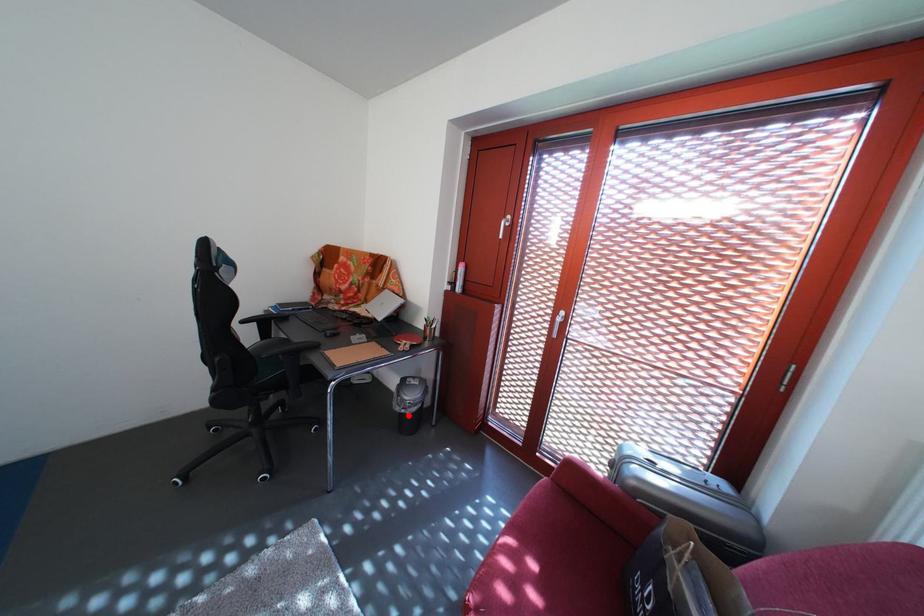
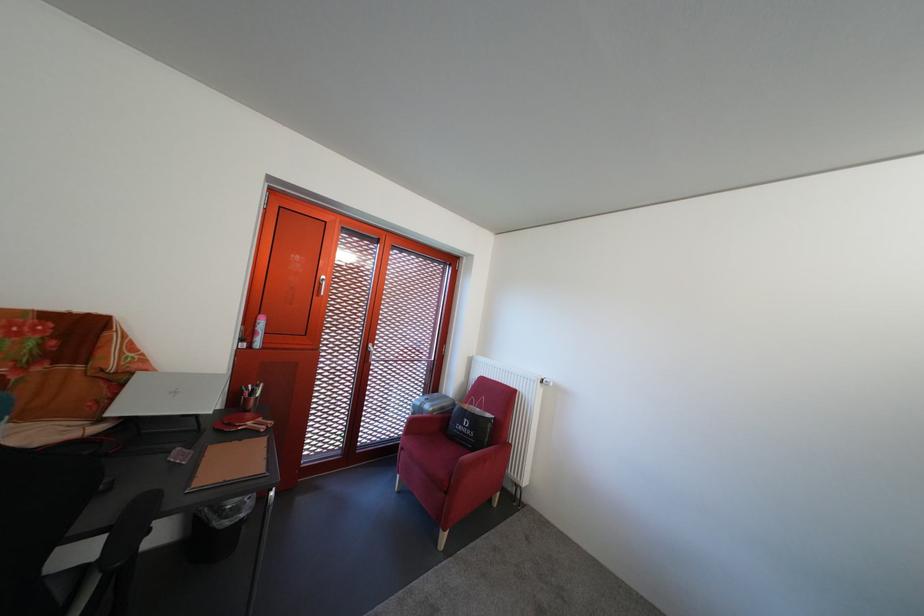
Locate, in the second image, the point that corresponds to the highlighted location in the first image.

(237, 530)